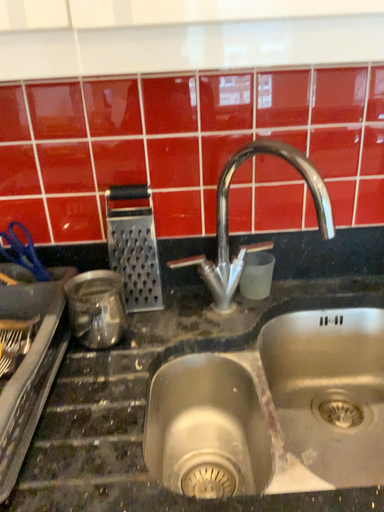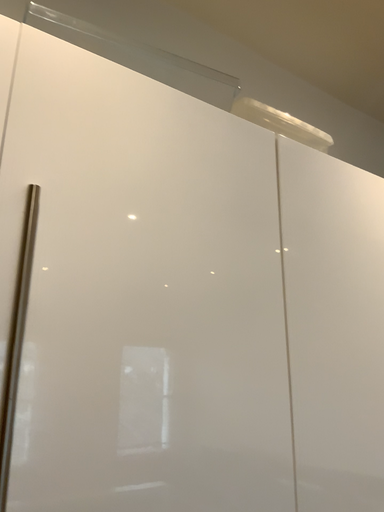
Question: How did the camera likely rotate when shooting the video?

Choices:
 (A) rotated upward
 (B) rotated downward

Answer: (A)